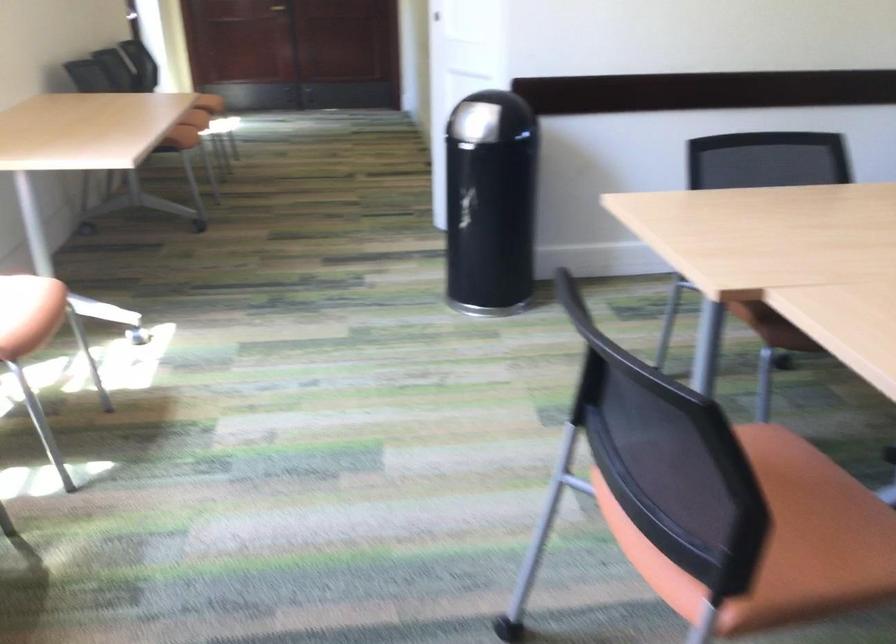
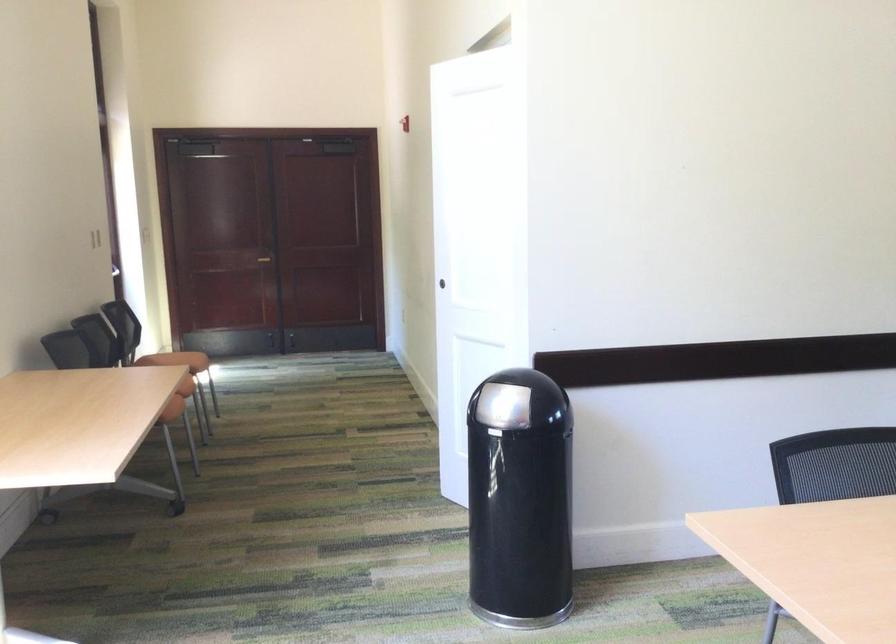
Question: How did the camera likely rotate?

Choices:
 (A) Left
 (B) Right
 (C) Up
 (D) Down

Answer: (C)